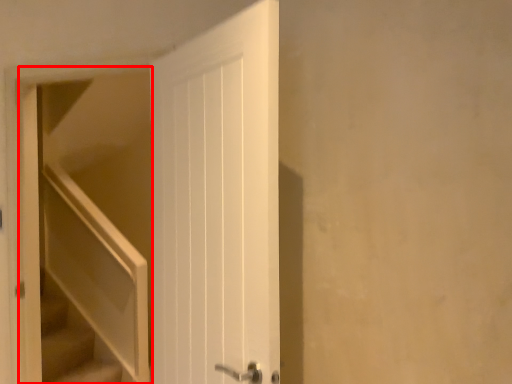
Question: Observing the image, what is the correct spatial positioning of elevator (annotated by the red box) in reference to stairs?

Choices:
 (A) left
 (B) right

Answer: (B)